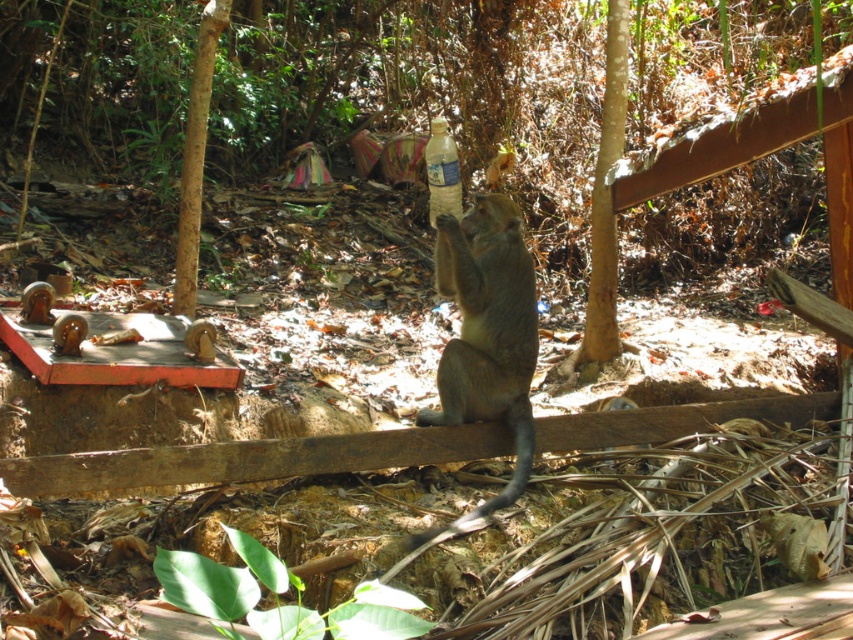
Question: Does brown furry monkey at center have a greater width compared to translucent plastic bottle at center?

Choices:
 (A) yes
 (B) no

Answer: (A)

Question: In this image, where is brown furry monkey at center located relative to brown rough tree at upper left?

Choices:
 (A) right
 (B) left

Answer: (A)

Question: Which point is closer to the camera taking this photo?

Choices:
 (A) (503, 316)
 (B) (196, 284)

Answer: (A)

Question: Which point appears farthest from the camera in this image?

Choices:
 (A) (602, 160)
 (B) (190, 298)

Answer: (A)

Question: Among these points, which one is farthest from the camera?

Choices:
 (A) (608, 205)
 (B) (430, 218)
 (C) (404, 544)

Answer: (B)

Question: Does brown rough tree at upper left appear on the right side of translucent plastic bottle at center?

Choices:
 (A) yes
 (B) no

Answer: (B)